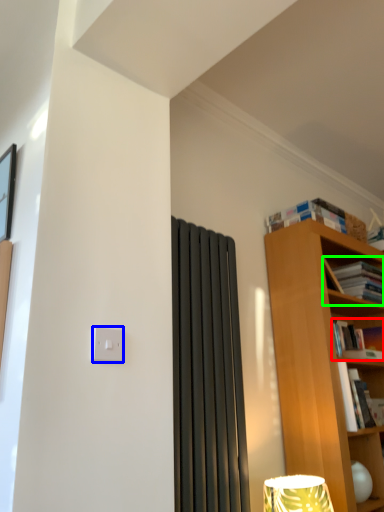
Question: Estimate the real-world distances between objects in this image. Which object is farther from book (highlighted by a red box), light switch (highlighted by a blue box) or book (highlighted by a green box)?

Choices:
 (A) light switch
 (B) book

Answer: (A)